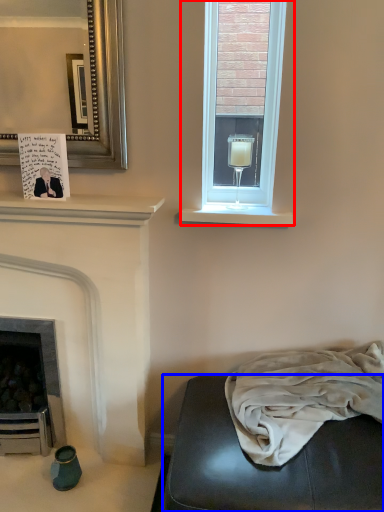
Question: Which point is closer to the camera, window (highlighted by a red box) or studio couch (highlighted by a blue box)?

Choices:
 (A) window
 (B) studio couch

Answer: (B)